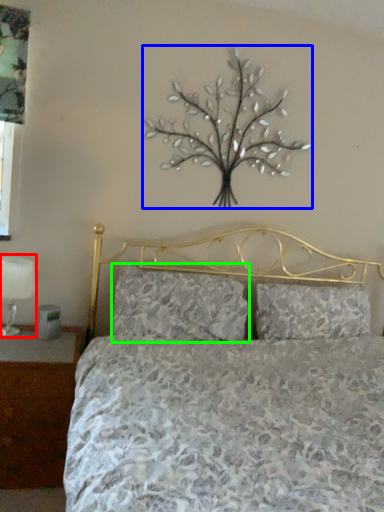
Question: Based on their relative distances, which object is farther from table lamp (highlighted by a red box)? Choose from flower (highlighted by a blue box) and pillow (highlighted by a green box).

Choices:
 (A) flower
 (B) pillow

Answer: (A)